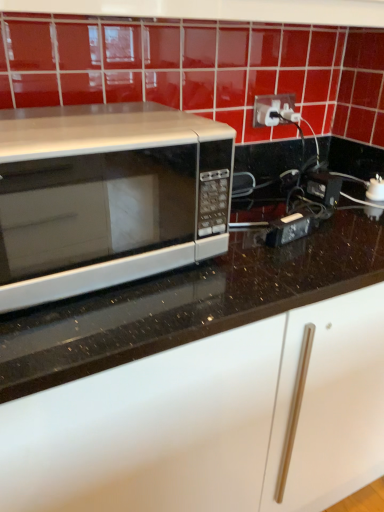
Question: From the image's perspective, is white plastic outlet at upper right located above or below satin silver microwave at left?

Choices:
 (A) below
 (B) above

Answer: (B)

Question: Looking at their shapes, would you say white plastic outlet at upper right is wider or thinner than satin silver microwave at left?

Choices:
 (A) wide
 (B) thin

Answer: (B)

Question: Visually, is white plastic outlet at upper right positioned to the left or to the right of satin silver microwave at left?

Choices:
 (A) left
 (B) right

Answer: (B)

Question: In terms of height, does satin silver microwave at left look taller or shorter compared to white plastic outlet at upper right?

Choices:
 (A) short
 (B) tall

Answer: (B)

Question: In terms of size, does satin silver microwave at left appear bigger or smaller than white plastic outlet at upper right?

Choices:
 (A) big
 (B) small

Answer: (A)

Question: Considering their positions, is satin silver microwave at left located in front of or behind white plastic outlet at upper right?

Choices:
 (A) behind
 (B) front

Answer: (B)

Question: Do you think satin silver microwave at left is within white plastic outlet at upper right, or outside of it?

Choices:
 (A) outside
 (B) inside

Answer: (A)